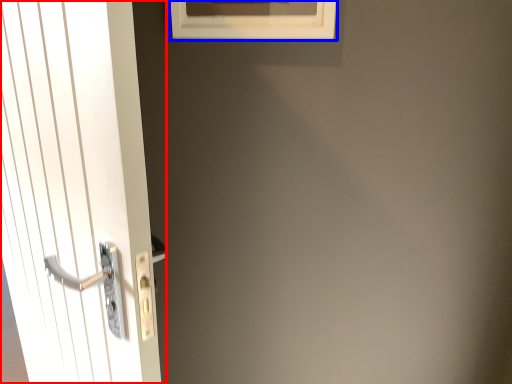
Question: Which of the following is the closest to the observer, door (highlighted by a red box) or window (highlighted by a blue box)?

Choices:
 (A) door
 (B) window

Answer: (A)